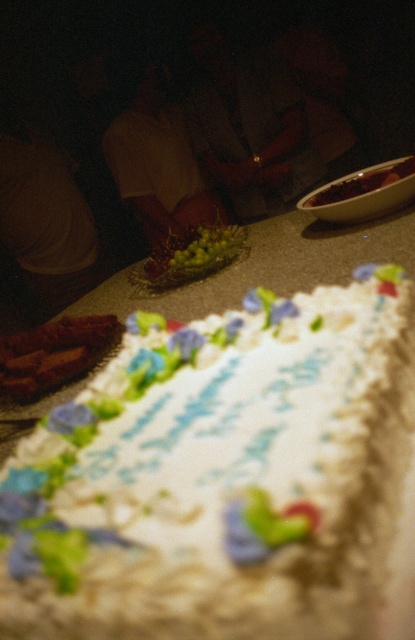
Is smokey brown meat at lower left smaller than smooth brown bowl at center?

Yes, smokey brown meat at lower left is smaller than smooth brown bowl at center.

Which is in front, point (77, 330) or point (373, 170)?

Positioned in front is point (77, 330).

Is point (68, 364) positioned before point (353, 195)?

Yes, it is.

Where is `smokey brown meat at lower left`? smokey brown meat at lower left is located at coordinates (x=53, y=353).

Between point (17, 344) and point (193, 266), which one is positioned in front?

Positioned in front is point (17, 344).

Does point (31, 392) come closer to viewer compared to point (205, 264)?

Yes, it is.

Is point (24, 378) farther from camera compared to point (209, 269)?

No, (24, 378) is in front of (209, 269).

What are the coordinates of `smokey brown meat at lower left` in the screenshot? It's located at (53, 353).

Who is taller, matte white shirt at center or smooth brown bowl at center?

matte white shirt at center

Does matte white shirt at center have a smaller size compared to smooth brown bowl at center?

Actually, matte white shirt at center might be larger than smooth brown bowl at center.

I want to click on matte white shirt at center, so click(x=158, y=164).